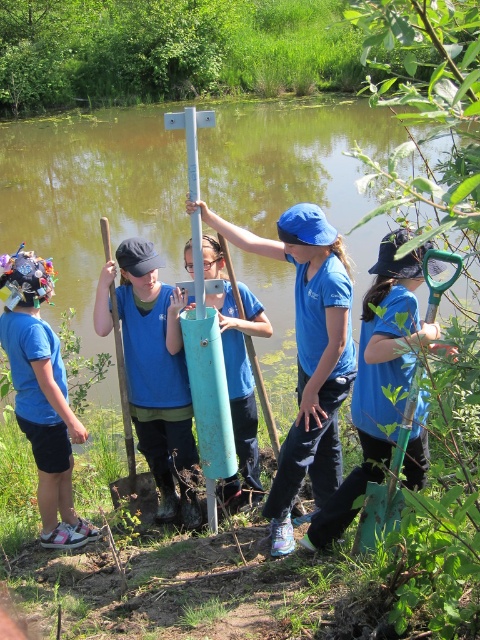
You are a photographer standing at the edge of the water. You want to take a photo that includes both the green metallic pole at center and the matte blue shirt at left. Which object should you position closer to the center of the frame to ensure both fit in the photo?

Since the green metallic pole at center is wider than the matte blue shirt at left, you should position the green metallic pole at center closer to the center of the frame to accommodate its greater width while still including the matte blue shirt at left in the shot.

You are a child participating in the activity. You see the matte blue cylinder at center and the metallic silver pole at center. Which object is closer to you?

The matte blue cylinder at center is closer to you because the metallic silver pole at center is behind it.

You are a photographer positioned at the origin point of the scene. You need to place a green metallic pole at center in your shot. What are the coordinates where you should position it?

The green metallic pole at center should be positioned at coordinates point [92,196].